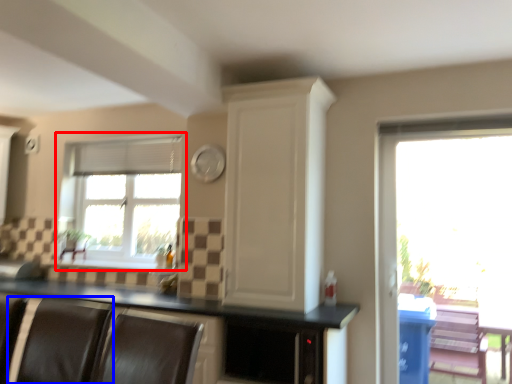
Question: Which object appears closest to the camera in this image, window (highlighted by a red box) or armchair (highlighted by a blue box)?

Choices:
 (A) window
 (B) armchair

Answer: (B)